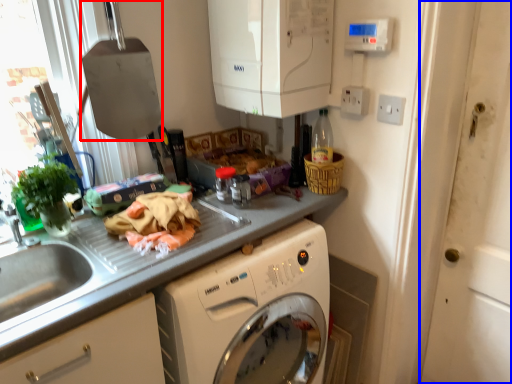
Question: Among these objects, which one is farthest to the camera, appliance (highlighted by a red box) or screen door (highlighted by a blue box)?

Choices:
 (A) appliance
 (B) screen door

Answer: (A)